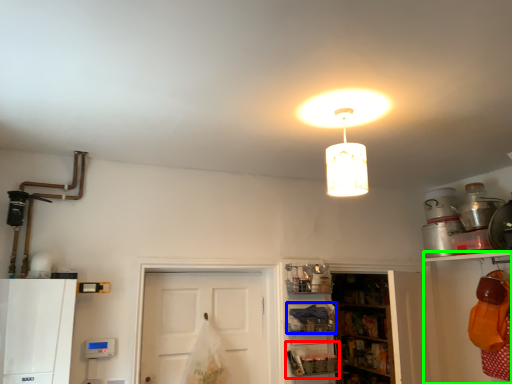
Question: Which object is the closest to the shelf (highlighted by a red box)? Choose among these: shelf (highlighted by a blue box) or shelf (highlighted by a green box).

Choices:
 (A) shelf
 (B) shelf

Answer: (A)